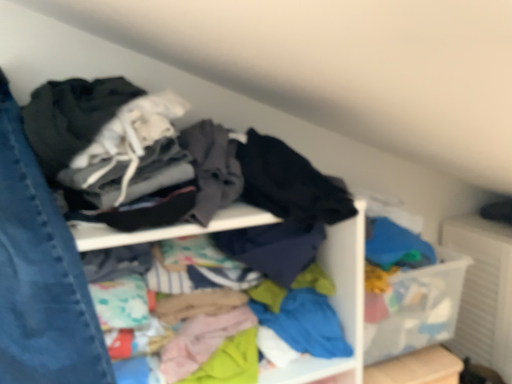
The height and width of the screenshot is (384, 512). Describe the element at coordinates (40, 275) in the screenshot. I see `denim at left` at that location.

The image size is (512, 384). Find the location of `denim at left`. denim at left is located at coordinates (40, 275).

Identify the location of multicolored fabric at center. (338, 303).

Describe the element at coordinates (338, 303) in the screenshot. I see `multicolored fabric at center` at that location.

The image size is (512, 384). I want to click on denim at left, so click(x=40, y=275).

Considering the positions of objects multicolored fabric at center and denim at left in the image provided, who is more to the left, multicolored fabric at center or denim at left?

From the viewer's perspective, denim at left appears more on the left side.

Is multicolored fabric at center closer to camera compared to denim at left?

No.

In the scene shown: Which is nearer, (72, 231) or (102, 378)?

Point (72, 231) is positioned farther from the camera compared to point (102, 378).

In the scene shown: From the image's perspective, is multicolored fabric at center located beneath denim at left?

Yes, from the image's perspective, multicolored fabric at center is below denim at left.

From a real-world perspective, is multicolored fabric at center positioned over denim at left based on gravity?

Incorrect, from a real-world perspective, multicolored fabric at center is lower than denim at left.

Does multicolored fabric at center have a greater width compared to denim at left?

No.

In terms of height, does multicolored fabric at center look taller or shorter compared to denim at left?

multicolored fabric at center is shorter than denim at left.

Who is bigger, multicolored fabric at center or denim at left?

denim at left.

Is multicolored fabric at center completely or partially outside of denim at left?

multicolored fabric at center is positioned outside denim at left.

Are multicolored fabric at center and denim at left located far from each other?

No, multicolored fabric at center is not far from denim at left.

Is multicolored fabric at center aimed at denim at left?

Yes, multicolored fabric at center is turned towards denim at left.

From the picture: Can you tell me how much multicolored fabric at center and denim at left differ in facing direction?

They differ by 0.00128 degrees in their facing directions.

How much distance is there between multicolored fabric at center and denim at left?

They are 53.67 centimeters apart.

Identify the location of jeans above the multicolored fabric at center (from a real-world perspective). (40, 275).

Does denim at left appear on the right side of multicolored fabric at center?

Incorrect, denim at left is not on the right side of multicolored fabric at center.

Is denim at left further to camera compared to multicolored fabric at center?

That is False.

Does point (49, 318) lie behind point (325, 362)?

That is False.

From the image's perspective, does denim at left appear higher than multicolored fabric at center?

Indeed, from the image's perspective, denim at left is shown above multicolored fabric at center.

From a real-world perspective, is denim at left on multicolored fabric at center?

Indeed, from a real-world perspective, denim at left stands above multicolored fabric at center.

In terms of width, does denim at left look wider or thinner when compared to multicolored fabric at center?

Clearly, denim at left has more width compared to multicolored fabric at center.

Which of these two, denim at left or multicolored fabric at center, stands shorter?

multicolored fabric at center.

Can you confirm if denim at left is bigger than multicolored fabric at center?

Correct, denim at left is larger in size than multicolored fabric at center.

Is multicolored fabric at center completely or partially inside denim at left?

No, multicolored fabric at center is not inside denim at left.

From the picture: Is denim at left with multicolored fabric at center?

No, denim at left is not beside multicolored fabric at center.

Is denim at left oriented towards multicolored fabric at center?

Yes, denim at left faces towards multicolored fabric at center.

How far apart are denim at left and multicolored fabric at center?

They are 21.13 inches apart.

Identify the location of cabinet that appears on the right of denim at left. The image size is (512, 384). (338, 303).

Where is `jeans in front of the multicolored fabric at center`? jeans in front of the multicolored fabric at center is located at coordinates (40, 275).

Locate an element on the screen. Image resolution: width=512 pixels, height=384 pixels. jeans on the left of multicolored fabric at center is located at coordinates (40, 275).